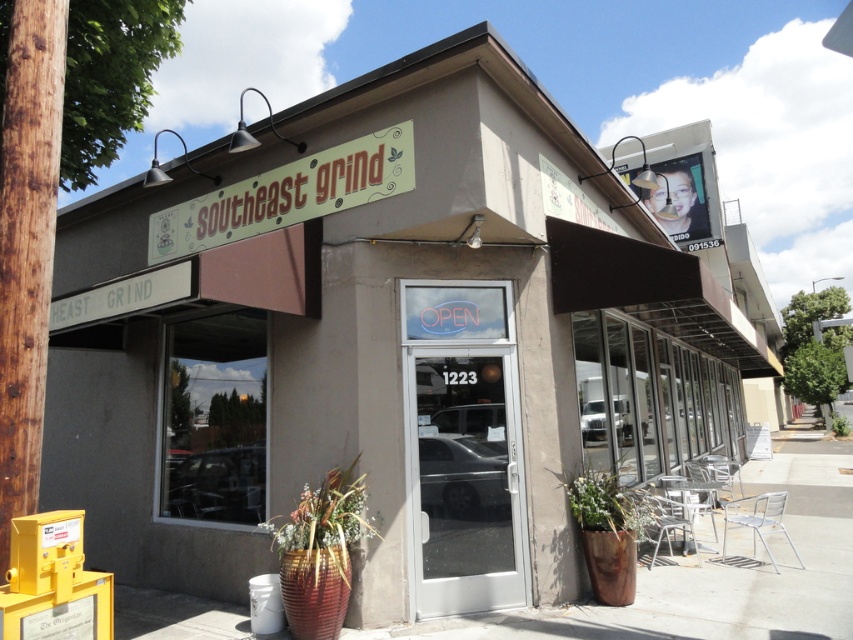
Question: Is brown wood pole at left below white painted wood signboard at upper center?

Choices:
 (A) yes
 (B) no

Answer: (A)

Question: Is the position of brown wood pole at left less distant than that of white painted wood signboard at upper center?

Choices:
 (A) no
 (B) yes

Answer: (B)

Question: Is brown wood pole at left positioned before white painted wood signboard at upper center?

Choices:
 (A) yes
 (B) no

Answer: (A)

Question: Which object is closer to the camera taking this photo?

Choices:
 (A) white painted wood signboard at upper center
 (B) brown wood pole at left

Answer: (B)

Question: Which object is closer to the camera taking this photo?

Choices:
 (A) white painted wood signboard at upper center
 (B) brown wood pole at left

Answer: (B)